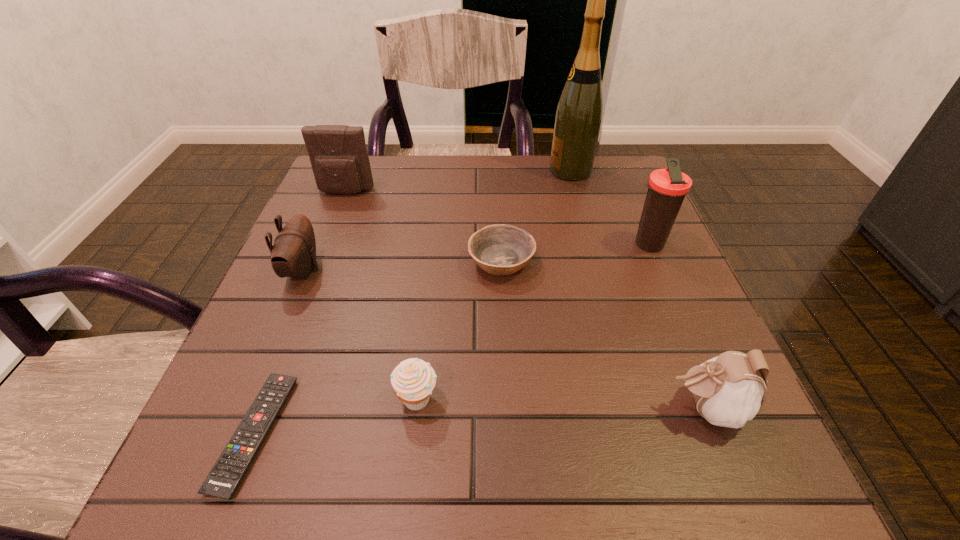
You are a GUI agent. You are given a task and a screenshot of the screen. Output one action in this format:
    pyautogui.click(x=<x>, y=<y>)
    Task: Click on the free space located 0.240m with the flap open on the second farthest pouch
    Image resolution: width=960 pixels, height=540 pixels.
    Given the screenshot: What is the action you would take?
    pyautogui.click(x=439, y=270)

You are a GUI agent. You are given a task and a screenshot of the screen. Output one action in this format:
    pyautogui.click(x=<x>, y=<y>)
    Task: Click on the vacant point located on the back of the muffin
    
    Given the screenshot: What is the action you would take?
    pyautogui.click(x=429, y=294)

In order to click on blank space located 0.350m on the left of the seventh tallest object in this screenshot , I will do [298, 261].

Locate an element on the screen. vacant region located on the back of the shortest object is located at coordinates (330, 239).

Locate an element on the screen. The image size is (960, 540). wine bottle that is at the far edge is located at coordinates (579, 113).

The height and width of the screenshot is (540, 960). I want to click on pouch at the far edge, so click(x=338, y=155).

At what (x,y) coordinates should I click in order to perform the action: click on pouch that is at the near edge. Please return your answer as a coordinate pair (x, y). Image resolution: width=960 pixels, height=540 pixels. Looking at the image, I should click on (729, 389).

The width and height of the screenshot is (960, 540). In order to click on remote control situated at the near edge in this screenshot , I will do `click(229, 470)`.

Locate an element on the screen. This screenshot has height=540, width=960. remote control that is positioned at the left edge is located at coordinates (229, 470).

Locate an element on the screen. wine bottle at the right edge is located at coordinates (579, 113).